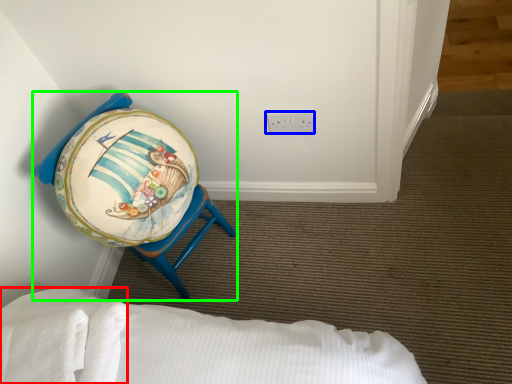
Question: Which object is positioned closest to sheet (highlighted by a red box)? Select from electric outlet (highlighted by a blue box) and furniture (highlighted by a green box).

Choices:
 (A) electric outlet
 (B) furniture

Answer: (B)